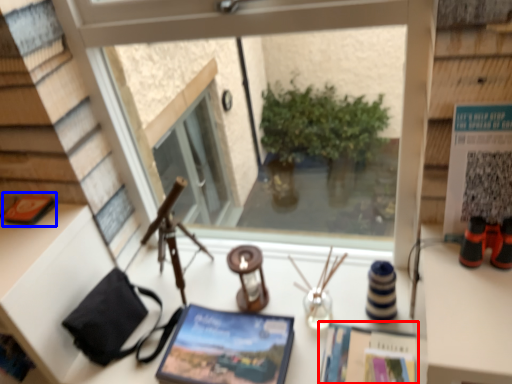
Question: Among these objects, which one is farthest to the camera, magazine (highlighted by a red box) or book (highlighted by a blue box)?

Choices:
 (A) magazine
 (B) book

Answer: (B)